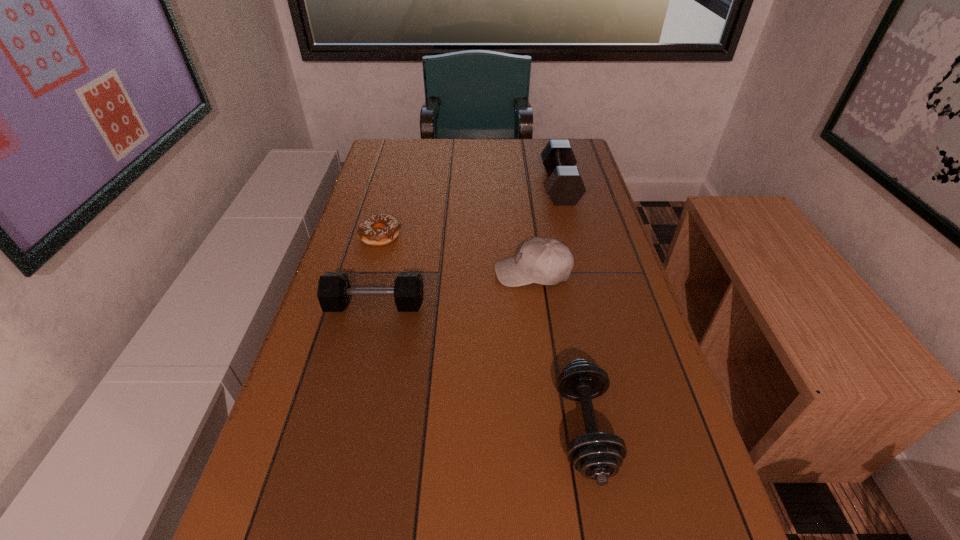
Locate an element on the screen. the farthest dumbbell is located at coordinates (565, 185).

Image resolution: width=960 pixels, height=540 pixels. I want to click on the nearest dumbbell, so pos(598,456).

At what (x,y) coordinates should I click in order to perform the action: click on the third farthest object. Please return your answer as a coordinate pair (x, y). This screenshot has height=540, width=960. Looking at the image, I should click on (545, 261).

At what (x,y) coordinates should I click in order to perform the action: click on the leftmost dumbbell. Please return your answer as a coordinate pair (x, y). The height and width of the screenshot is (540, 960). Looking at the image, I should click on (334, 290).

Image resolution: width=960 pixels, height=540 pixels. What are the coordinates of `the second nearest dumbbell` in the screenshot? It's located at (334, 290).

You are a GUI agent. You are given a task and a screenshot of the screen. Output one action in this format:
    pyautogui.click(x=<x>, y=<y>)
    Task: Click on the second farthest object
    The width and height of the screenshot is (960, 540).
    Given the screenshot: What is the action you would take?
    pyautogui.click(x=368, y=231)

Locate an element on the screen. doughnut is located at coordinates tap(368, 231).

Where is `vacant space situated 0.320m on the front of the farthest object`? This screenshot has width=960, height=540. vacant space situated 0.320m on the front of the farthest object is located at coordinates (584, 278).

You are a GUI agent. You are given a task and a screenshot of the screen. Output one action in this format:
    pyautogui.click(x=<x>, y=<y>)
    Task: Click on the free space located on the left of the nearest object
    
    Given the screenshot: What is the action you would take?
    pyautogui.click(x=355, y=429)

What are the coordinates of `blank area located 0.150m on the front-facing side of the baseball cap` in the screenshot? It's located at (436, 272).